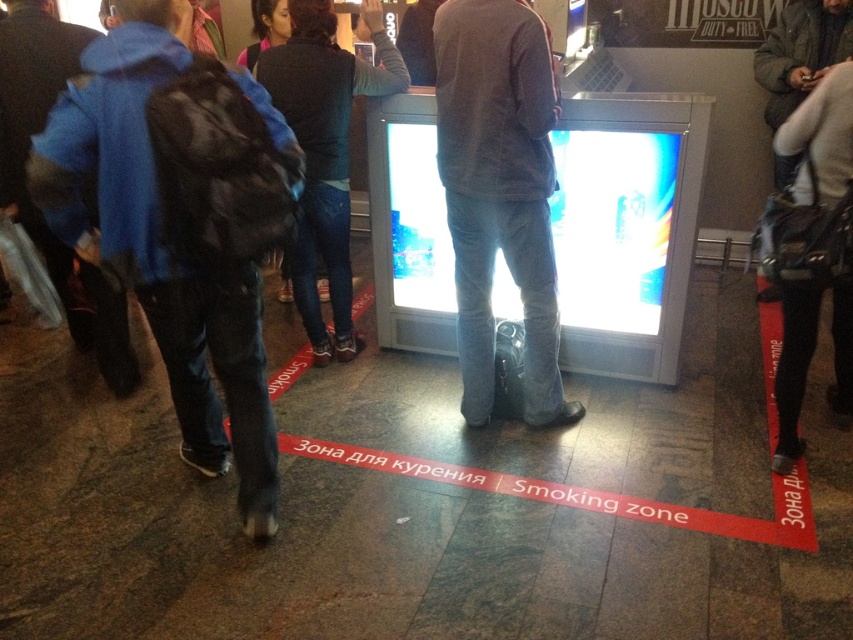
You are standing in the airport and want to ask the person in the dark gray sweater at center for directions. Which direction should you move relative to the matte blue jacket at left to reach them?

The matte blue jacket at left is to the left of the dark gray sweater at center, so you should move to the right from the matte blue jacket at left to reach the dark gray sweater at center.

You are standing at the point marked as point (180,221) in the image. What object are you touching?

You are touching the matte blue jacket at left.

You are a photographer trying to capture a candid shot of the dark gray sweater at center and the dark blue jeans at center in the airport scene. Since you want both subjects to be clearly visible in the frame, which clothing item should you focus on first to ensure proper focus, considering their sizes?

The dark gray sweater at center has a smaller size compared to dark blue jeans at center, so you should focus on the dark gray sweater at center first to ensure it is in clear focus, as smaller objects may require more precise focusing to capture details.